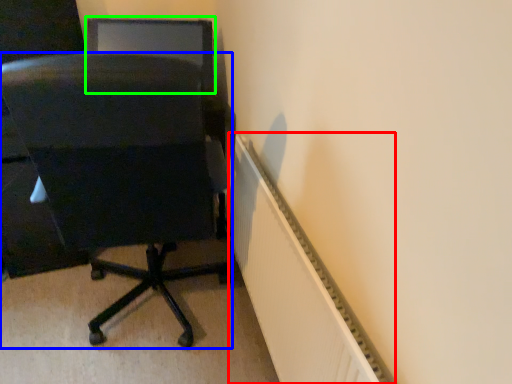
Question: Which object is the closest to the radiator (highlighted by a red box)? Choose among these: chair (highlighted by a blue box) or computer monitor (highlighted by a green box).

Choices:
 (A) chair
 (B) computer monitor

Answer: (A)